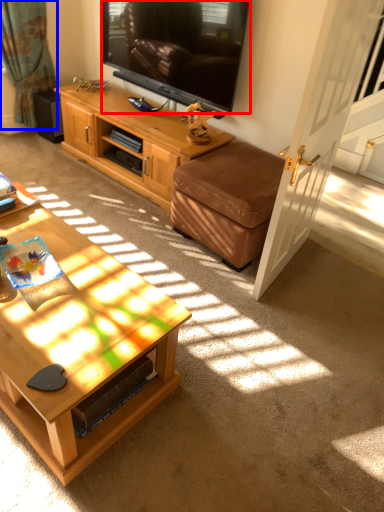
Question: Which object is closer to the camera taking this photo, television (highlighted by a red box) or curtain (highlighted by a blue box)?

Choices:
 (A) television
 (B) curtain

Answer: (A)